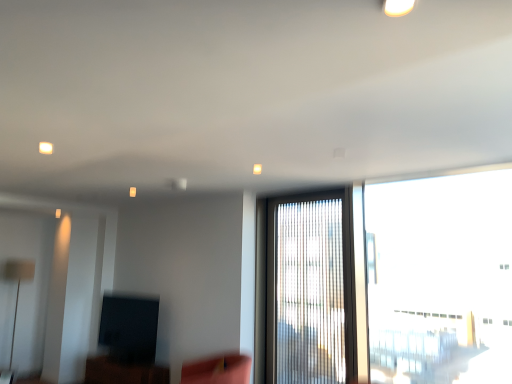
Question: Considering their positions, is white glossy light fixture at upper center located in front of or behind velvet pink swivel chair at lower center?

Choices:
 (A) front
 (B) behind

Answer: (A)

Question: Would you say white glossy light fixture at upper center is to the left or to the right of velvet pink swivel chair at lower center in the picture?

Choices:
 (A) left
 (B) right

Answer: (B)

Question: Estimate the real-world distances between objects in this image. Which object is closer to the matte black tv at lower left?

Choices:
 (A) transparent glass window at right, the 1th window positioned from the right
 (B) translucent glass window at center, which appears as the 1th window when viewed from the left
 (C) matte black tv at lower left
 (D) velvet pink swivel chair at lower center
 (E) white glossy light fixture at upper center

Answer: (C)

Question: Based on their relative distances, which object is nearer to the transparent glass window at right, the 1th window positioned from the right?

Choices:
 (A) velvet pink swivel chair at lower center
 (B) white glossy light fixture at upper center
 (C) translucent glass window at center, which appears as the 1th window when viewed from the left
 (D) matte black tv at lower left
 (E) matte black tv at lower left

Answer: (C)